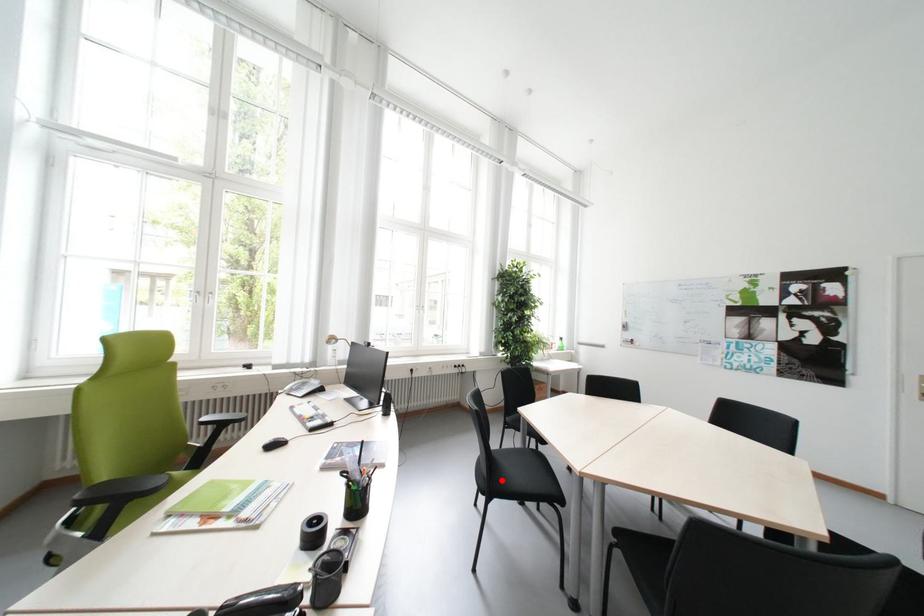
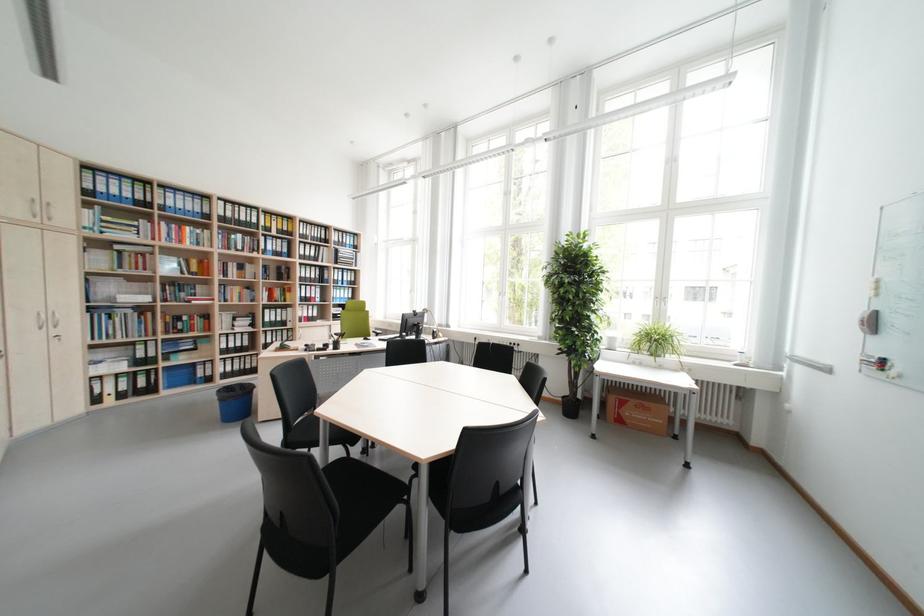
Question: I am providing you with two images of the same scene from different viewpoints. A red point is marked on the first image. Can you still see the location of the red point in image 2?

Choices:
 (A) Yes
 (B) No

Answer: (B)